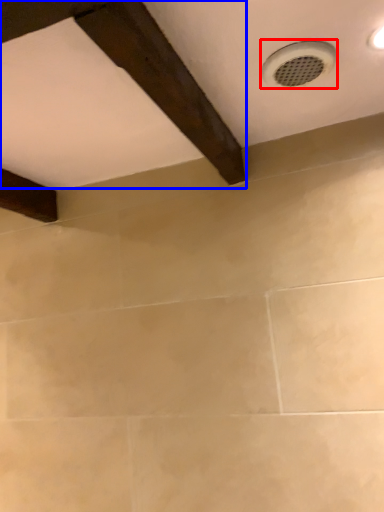
Question: Which point is further to the camera, plumbing fixture (highlighted by a red box) or exhaust hood (highlighted by a blue box)?

Choices:
 (A) plumbing fixture
 (B) exhaust hood

Answer: (A)